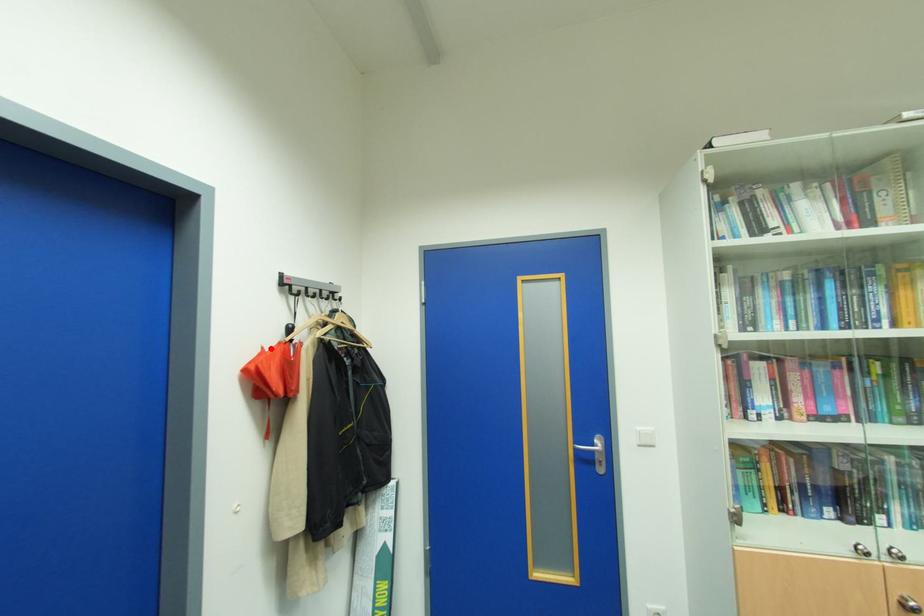
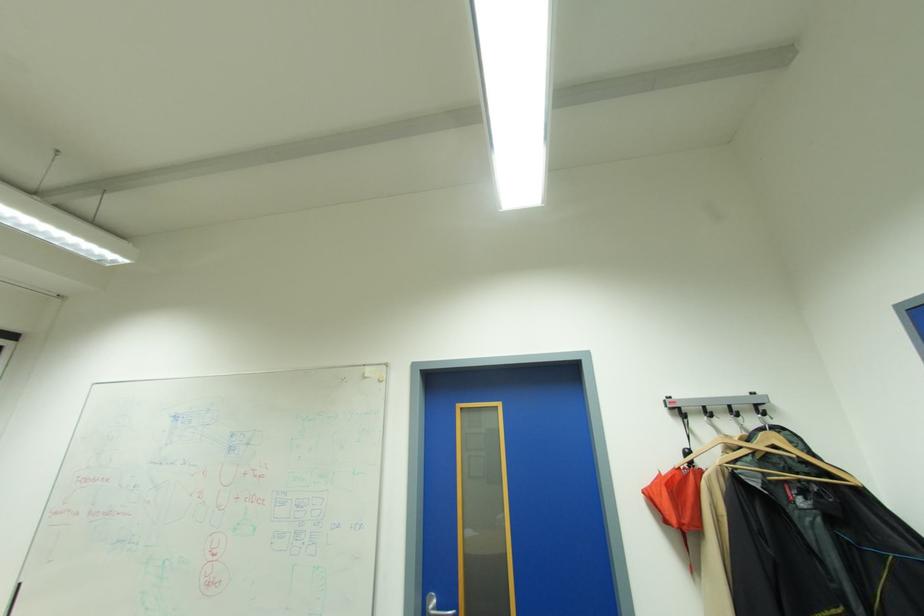
Find the pixel in the second image that matches the highlighted location in the first image.

(667, 474)